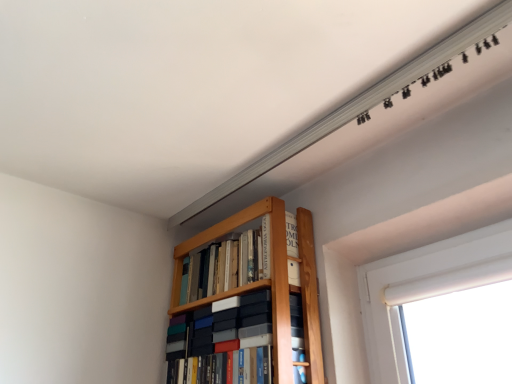
Question: Looking at the image, does wooden bookshelf at upper center, marked as the 1th book in a top-to-bottom arrangement, seem bigger or smaller compared to matte black book at center, the 2th book when ordered from top to bottom?

Choices:
 (A) big
 (B) small

Answer: (B)

Question: In terms of width, does wooden bookshelf at upper center, which is the 2th book in bottom-to-top order, look wider or thinner when compared to matte black book at center, the 2th book when ordered from top to bottom?

Choices:
 (A) thin
 (B) wide

Answer: (A)

Question: Considering the relative positions of wooden bookshelf at upper center, which is the 2th book in bottom-to-top order, and matte black book at center, the 2th book when ordered from top to bottom, in the image provided, is wooden bookshelf at upper center, which is the 2th book in bottom-to-top order, to the left or to the right of matte black book at center, the 2th book when ordered from top to bottom,?

Choices:
 (A) right
 (B) left

Answer: (A)

Question: Considering the positions of matte black book at center, the 1th book in the bottom-to-top sequence, and wooden bookshelf at upper center, which is the 2th book in bottom-to-top order, in the image, is matte black book at center, the 1th book in the bottom-to-top sequence, taller or shorter than wooden bookshelf at upper center, which is the 2th book in bottom-to-top order,?

Choices:
 (A) tall
 (B) short

Answer: (A)

Question: From the image's perspective, is matte black book at center, the 1th book in the bottom-to-top sequence, located above or below wooden bookshelf at upper center, which is the 2th book in bottom-to-top order?

Choices:
 (A) below
 (B) above

Answer: (A)

Question: Considering the positions of matte black book at center, the 1th book in the bottom-to-top sequence, and wooden bookshelf at upper center, marked as the 1th book in a top-to-bottom arrangement, in the image, is matte black book at center, the 1th book in the bottom-to-top sequence, wider or thinner than wooden bookshelf at upper center, marked as the 1th book in a top-to-bottom arrangement,?

Choices:
 (A) wide
 (B) thin

Answer: (A)

Question: Based on their sizes in the image, would you say matte black book at center, the 1th book in the bottom-to-top sequence, is bigger or smaller than wooden bookshelf at upper center, which is the 2th book in bottom-to-top order?

Choices:
 (A) small
 (B) big

Answer: (B)